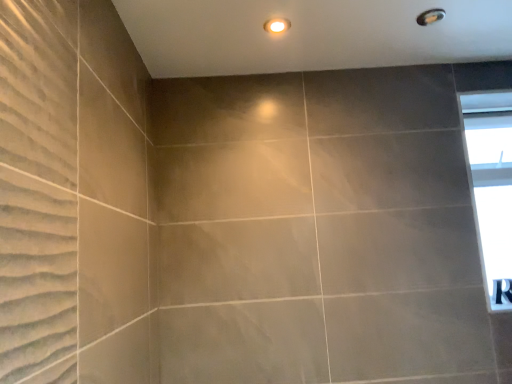
Question: Does transparent glass window at upper right have a smaller size compared to matte white light fixture at upper center?

Choices:
 (A) no
 (B) yes

Answer: (A)

Question: Could you tell me if transparent glass window at upper right is facing matte white light fixture at upper center?

Choices:
 (A) no
 (B) yes

Answer: (A)

Question: Can you confirm if transparent glass window at upper right is wider than matte white light fixture at upper center?

Choices:
 (A) no
 (B) yes

Answer: (B)

Question: Does transparent glass window at upper right have a lesser height compared to matte white light fixture at upper center?

Choices:
 (A) no
 (B) yes

Answer: (A)

Question: From a real-world perspective, is transparent glass window at upper right positioned under matte white light fixture at upper center based on gravity?

Choices:
 (A) no
 (B) yes

Answer: (B)

Question: Is transparent glass window at upper right further to camera compared to matte white light fixture at upper center?

Choices:
 (A) yes
 (B) no

Answer: (A)

Question: Can you confirm if matte gray shower at upper right is bigger than transparent glass window at upper right?

Choices:
 (A) yes
 (B) no

Answer: (B)

Question: Is the position of matte gray shower at upper right less distant than that of transparent glass window at upper right?

Choices:
 (A) yes
 (B) no

Answer: (A)

Question: Is transparent glass window at upper right at the back of matte gray shower at upper right?

Choices:
 (A) no
 (B) yes

Answer: (A)

Question: Is matte gray shower at upper right far from transparent glass window at upper right?

Choices:
 (A) no
 (B) yes

Answer: (A)

Question: From the image's perspective, would you say matte gray shower at upper right is positioned over transparent glass window at upper right?

Choices:
 (A) no
 (B) yes

Answer: (B)

Question: Is matte gray shower at upper right at the left side of transparent glass window at upper right?

Choices:
 (A) no
 (B) yes

Answer: (B)

Question: Is matte white light fixture at upper center surrounding transparent glass window at upper right?

Choices:
 (A) yes
 (B) no

Answer: (B)